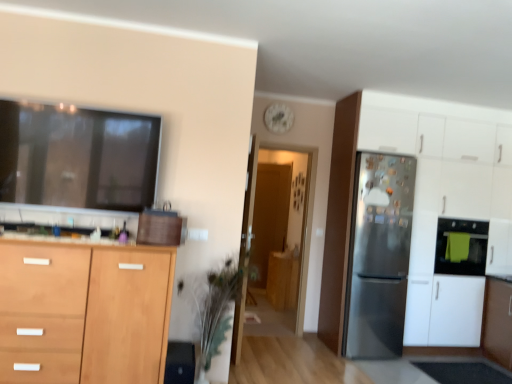
The height and width of the screenshot is (384, 512). What are the coordinates of `empty space that is ontop of green towel oven at right` in the screenshot? It's located at (464, 214).